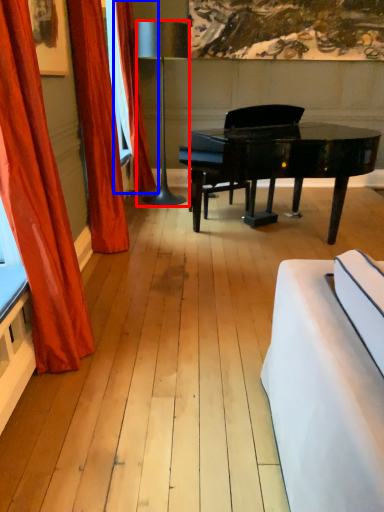
Question: Which object is further to the camera taking this photo, lamp (highlighted by a red box) or curtain (highlighted by a blue box)?

Choices:
 (A) lamp
 (B) curtain

Answer: (B)